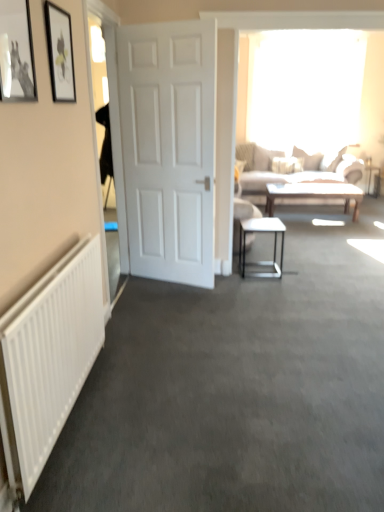
Question: Is metallic silver table at center positioned in front of white matte door at center?

Choices:
 (A) yes
 (B) no

Answer: (B)

Question: Is metallic silver table at center bigger than white matte door at center?

Choices:
 (A) yes
 (B) no

Answer: (B)

Question: Does metallic silver table at center have a smaller size compared to white matte door at center?

Choices:
 (A) no
 (B) yes

Answer: (B)

Question: Is metallic silver table at center behind white matte door at center?

Choices:
 (A) no
 (B) yes

Answer: (B)

Question: From a real-world perspective, does metallic silver table at center sit lower than white matte door at center?

Choices:
 (A) yes
 (B) no

Answer: (A)

Question: From a real-world perspective, is metallic silver table at center physically above white matte door at center?

Choices:
 (A) no
 (B) yes

Answer: (A)

Question: Is matte black picture frame at upper left, which is counted as the first picture frame, starting from the back, closer to the viewer compared to white matte door at center?

Choices:
 (A) yes
 (B) no

Answer: (A)

Question: Is matte black picture frame at upper left, which is counted as the first picture frame, starting from the back, facing away from white matte door at center?

Choices:
 (A) yes
 (B) no

Answer: (B)

Question: From the image's perspective, is matte black picture frame at upper left, the 2th picture frame when ordered from front to back, below white matte door at center?

Choices:
 (A) no
 (B) yes

Answer: (A)

Question: Is matte black picture frame at upper left, the 2th picture frame when ordered from front to back, not near white matte door at center?

Choices:
 (A) no
 (B) yes

Answer: (B)

Question: Is matte black picture frame at upper left, the 2th picture frame when ordered from front to back, to the right of white matte door at center from the viewer's perspective?

Choices:
 (A) no
 (B) yes

Answer: (A)

Question: Would you say matte black picture frame at upper left, the 2th picture frame when ordered from front to back, is outside white matte door at center?

Choices:
 (A) no
 (B) yes

Answer: (B)

Question: From a real-world perspective, is metallic silver picture frame at upper left, the 2th picture frame positioned from the back, on light beige fabric couch at upper right?

Choices:
 (A) no
 (B) yes

Answer: (B)